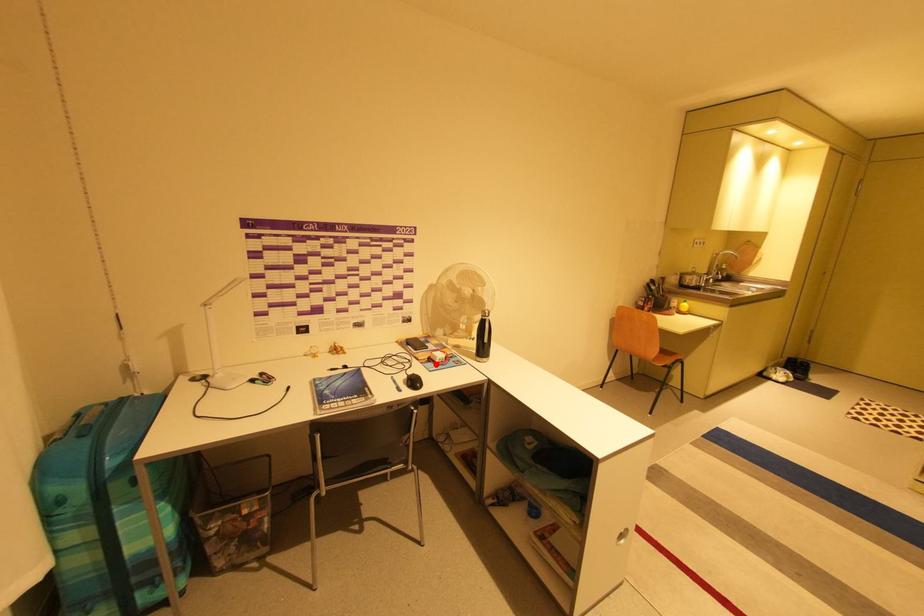
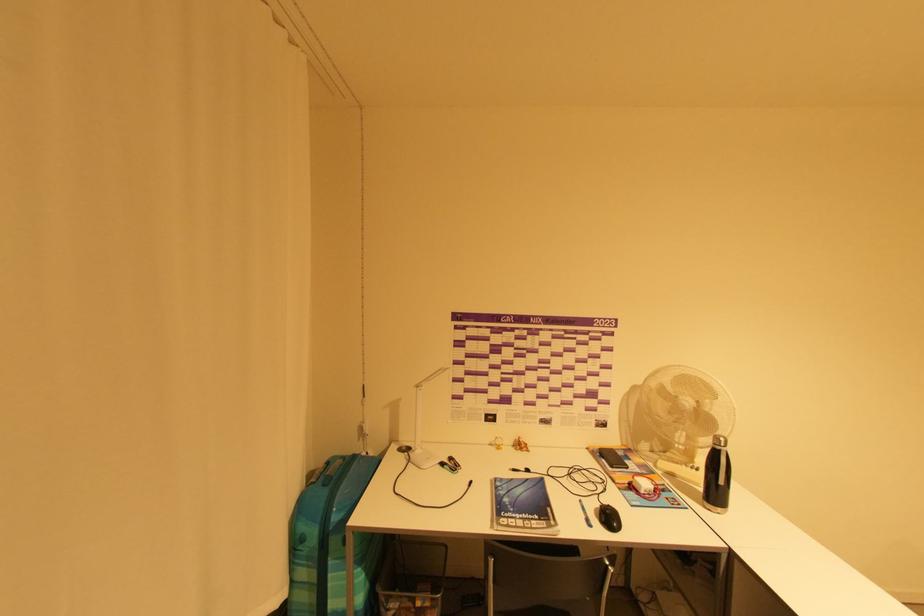
Find the pixel in the second image that matches the highlighted location in the first image.

(638, 493)